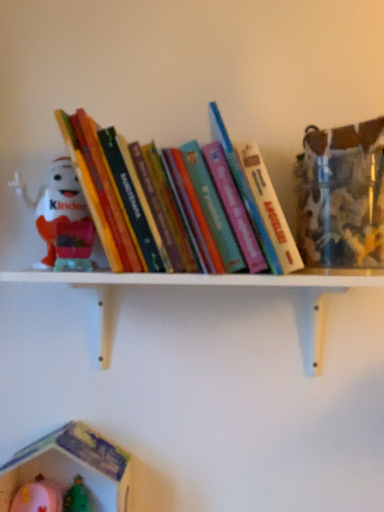
Question: Is plastic toy house at lower left, marked as the 1th toy in a bottom-to-top arrangement, situated inside matte plastic kinder egg at left, the 1th toy when ordered from top to bottom, or outside?

Choices:
 (A) inside
 (B) outside

Answer: (B)

Question: Is point (99, 445) closer or farther from the camera than point (54, 196)?

Choices:
 (A) closer
 (B) farther

Answer: (B)

Question: Estimate the real-world distances between objects in this image. Which object is closer to the matte plastic kinder egg at left, the 1th toy when ordered from top to bottom?

Choices:
 (A) white wooden shelf at upper center
 (B) plastic toy house at lower left, marked as the 1th toy in a bottom-to-top arrangement
 (C) hardcover books at center

Answer: (C)

Question: Estimate the real-world distances between objects in this image. Which object is farther from the plastic toy house at lower left, marked as the 1th toy in a bottom-to-top arrangement?

Choices:
 (A) white wooden shelf at upper center
 (B) matte plastic kinder egg at left, positioned as the 2th toy in bottom-to-top order
 (C) hardcover books at center

Answer: (C)